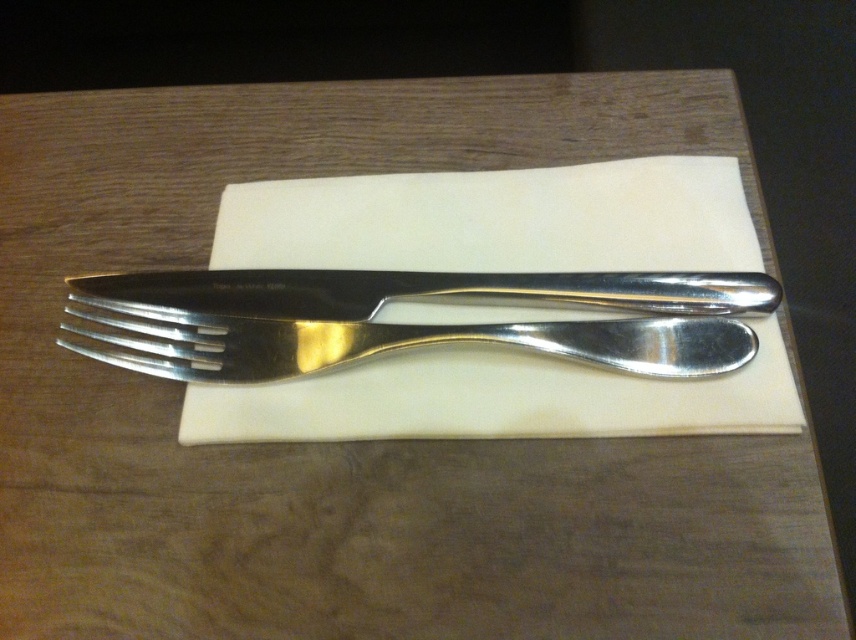
You are setting up a table for a formal dinner and need to place a decorative centerpiece between the two points labeled point (64,337) and point (217,301). Based on their positions, which point should the centerpiece be closer to in order to maintain proper table etiquette?

Since point (64,337) is closer to the viewer, the centerpiece should be placed closer to this point to adhere to formal table etiquette, which typically places the centerpiece near the host or main guest position.

You are setting up a dinner table and need to ensure proper spacing between the white paper napkin at center and the polished silver fork at center. According to etiquette guidelines, utensils should be placed 2 inches away from the napkin. Is the current placement compliant with this rule?

The white paper napkin at center is 2.25 inches away from the polished silver fork at center. Since the required distance is 2 inches, the current placement exceeds the recommended spacing by 0.25 inches, making it noncompliant with the etiquette guideline.

You are a server preparing a table and need to ensure that the polished silver fork at center and the polished silver knife at center are correctly sized for a main course. Which utensil is larger?

The polished silver fork at center is bigger than the polished silver knife at center, so the fork is the larger utensil for the main course.